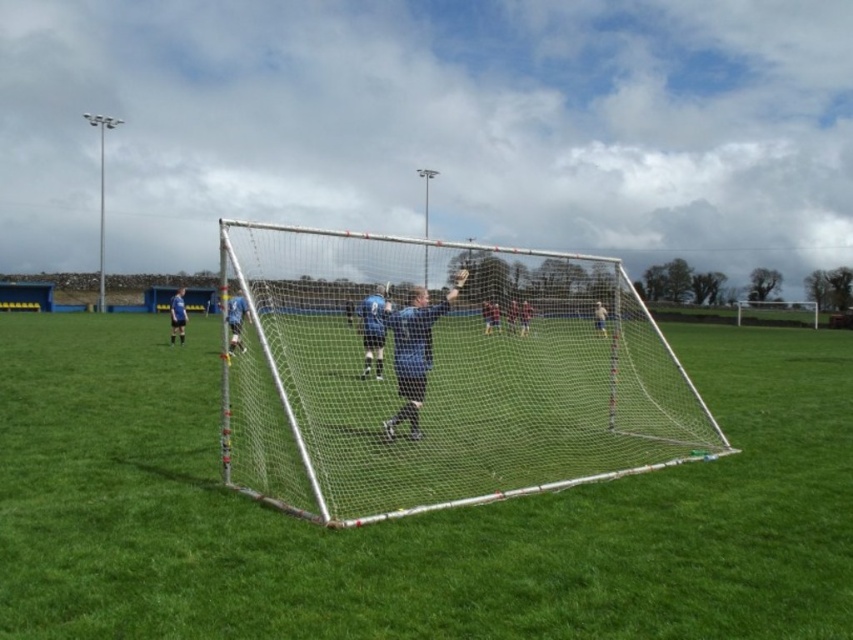
Question: Can you confirm if metallic silver goalpost at center is positioned to the left of silver/mesh net at center?

Choices:
 (A) yes
 (B) no

Answer: (A)

Question: Which of the following is the closest to the observer?

Choices:
 (A) (450, 612)
 (B) (294, 394)

Answer: (A)

Question: Is metallic silver goalpost at center behind silver/mesh net at center?

Choices:
 (A) no
 (B) yes

Answer: (A)

Question: Is metallic silver goalpost at center wider than silver/mesh net at center?

Choices:
 (A) yes
 (B) no

Answer: (A)

Question: Which of the following is the farthest from the observer?

Choices:
 (A) silver/mesh net at center
 (B) metallic silver goalpost at center

Answer: (A)